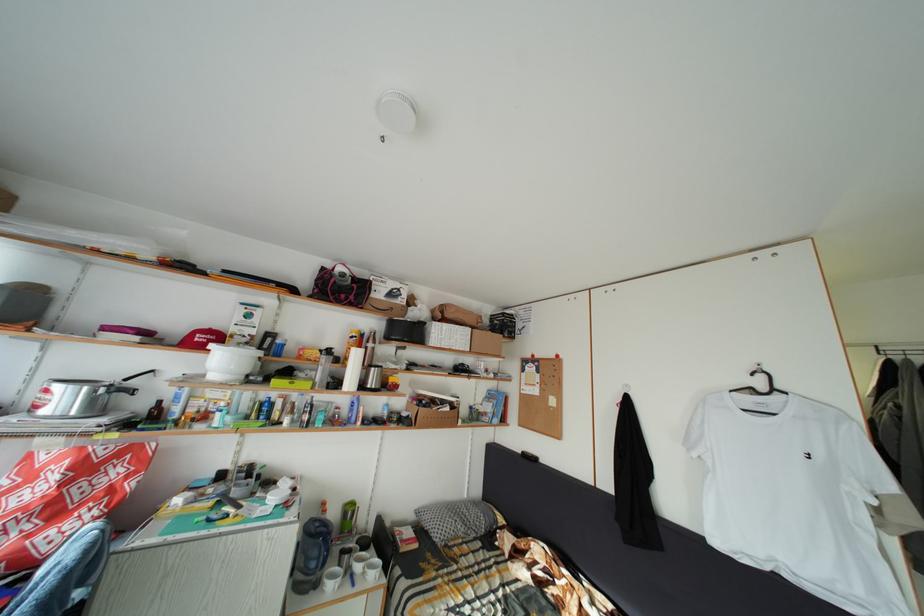
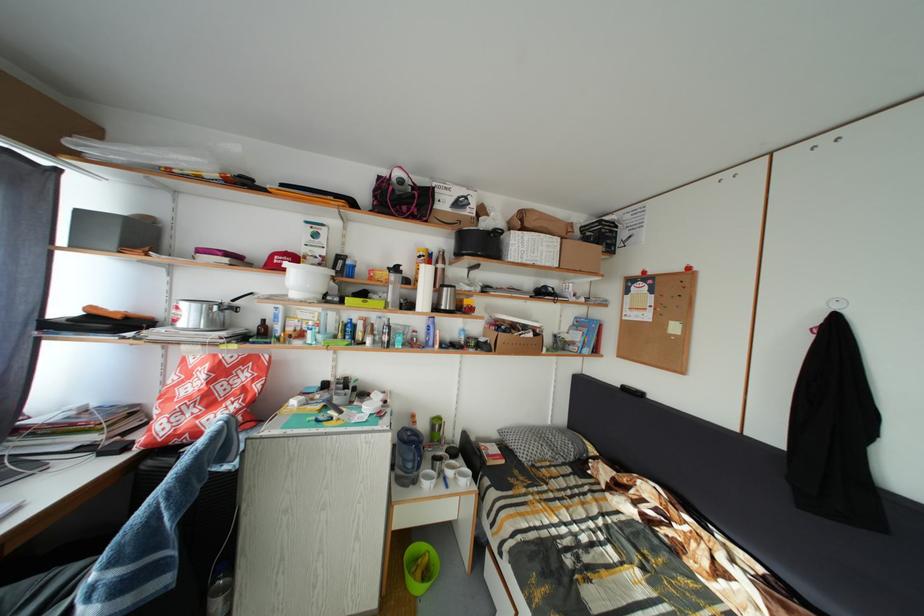
Which direction would the cameraman need to move to produce the second image?

The cameraman walked toward left, forward.